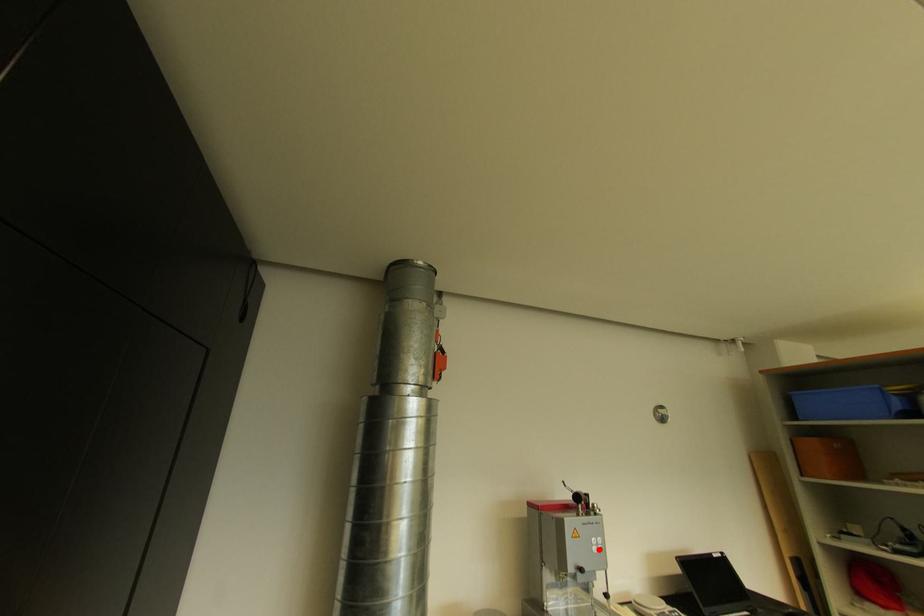
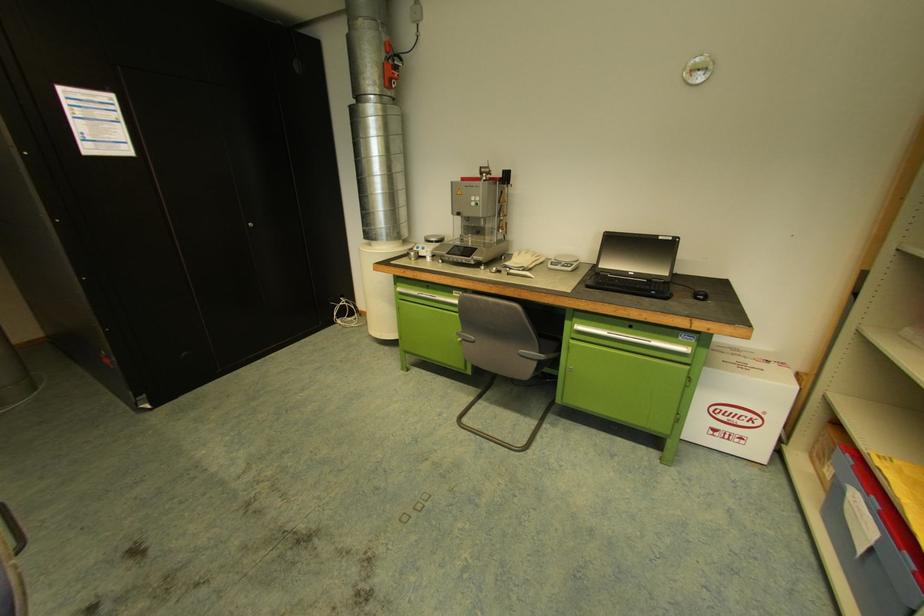
Where in the second image is the point corresponding to the highlighted location from the first image?

(477, 204)